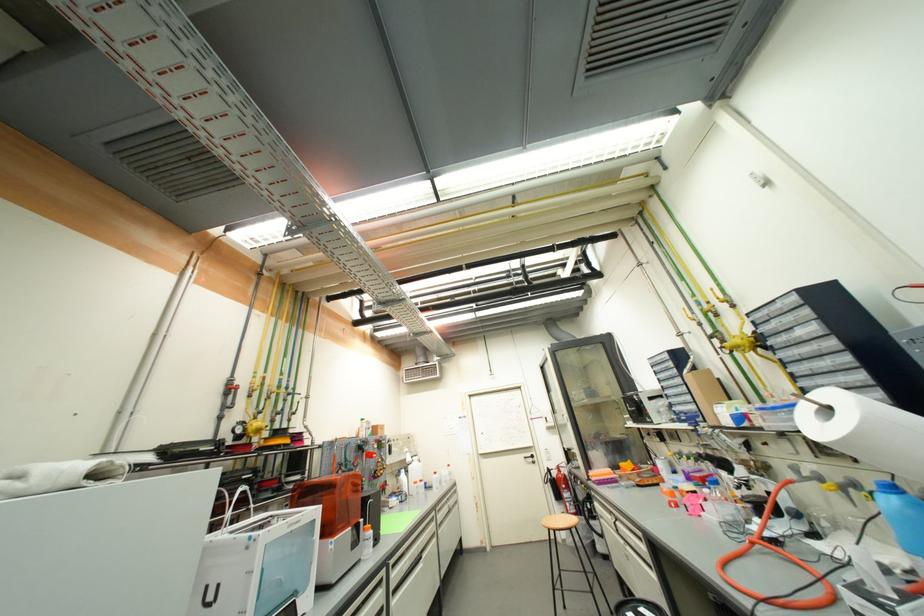
Where is `yellow valve handle`? This screenshot has width=924, height=616. yellow valve handle is located at coordinates (578, 485).